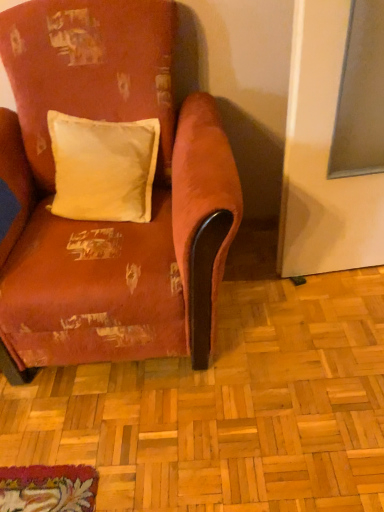
Identify the location of vacant space to the right of velvet-like red armchair at center. Image resolution: width=384 pixels, height=512 pixels. (299, 324).